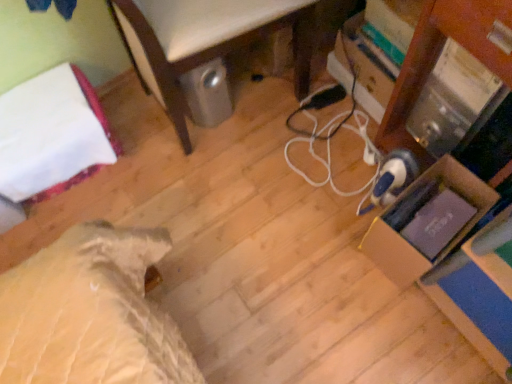
Question: Is cardboard box at right located within white cord at center?

Choices:
 (A) no
 (B) yes

Answer: (A)

Question: Can you confirm if white cord at center is bigger than cardboard box at right?

Choices:
 (A) no
 (B) yes

Answer: (A)

Question: From a real-world perspective, is white cord at center positioned over cardboard box at right based on gravity?

Choices:
 (A) yes
 (B) no

Answer: (B)

Question: Considering the relative sizes of white cord at center and cardboard box at right in the image provided, is white cord at center thinner than cardboard box at right?

Choices:
 (A) yes
 (B) no

Answer: (A)

Question: Is white cord at center facing away from cardboard box at right?

Choices:
 (A) yes
 (B) no

Answer: (B)

Question: Relative to white cord at center, is cardboard box at right in front or behind?

Choices:
 (A) behind
 (B) front

Answer: (B)

Question: Does point (373, 261) appear closer or farther from the camera than point (316, 124)?

Choices:
 (A) closer
 (B) farther

Answer: (A)

Question: From a real-world perspective, is cardboard box at right physically located above or below white cord at center?

Choices:
 (A) below
 (B) above

Answer: (B)

Question: In terms of width, does cardboard box at right look wider or thinner when compared to white cord at center?

Choices:
 (A) thin
 (B) wide

Answer: (B)

Question: From a real-world perspective, is white fabric bed at left physically located above or below white cord at center?

Choices:
 (A) above
 (B) below

Answer: (A)

Question: Considering the relative positions of white fabric bed at left and white cord at center in the image provided, is white fabric bed at left to the left or to the right of white cord at center?

Choices:
 (A) left
 (B) right

Answer: (A)

Question: From the image's perspective, is white fabric bed at left located above or below white cord at center?

Choices:
 (A) above
 (B) below

Answer: (A)

Question: Is white fabric bed at left inside the boundaries of white cord at center, or outside?

Choices:
 (A) outside
 (B) inside

Answer: (A)

Question: From a real-world perspective, is white fabric bed at left physically located above or below cardboard box at right?

Choices:
 (A) below
 (B) above

Answer: (A)

Question: Is white fabric bed at left to the left or to the right of cardboard box at right in the image?

Choices:
 (A) right
 (B) left

Answer: (B)